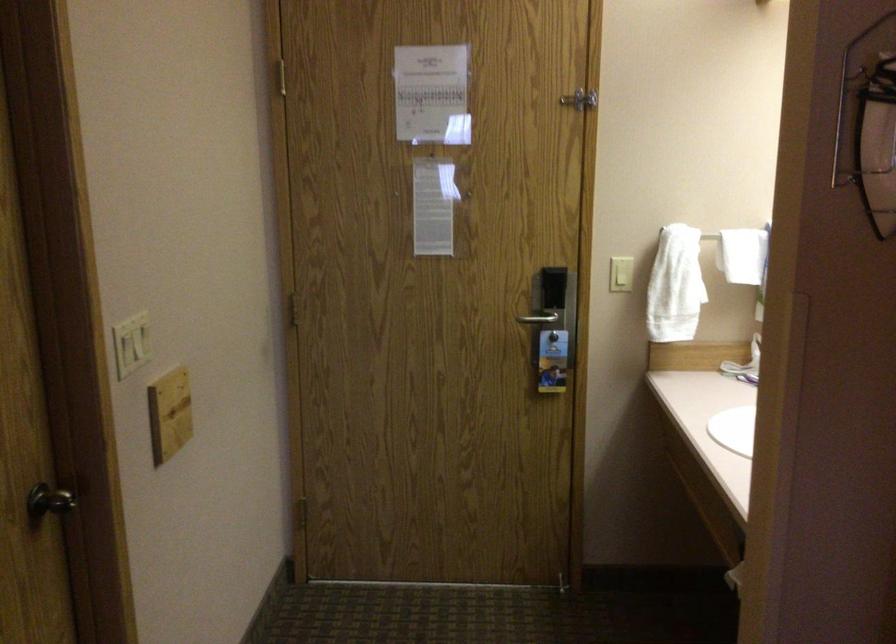
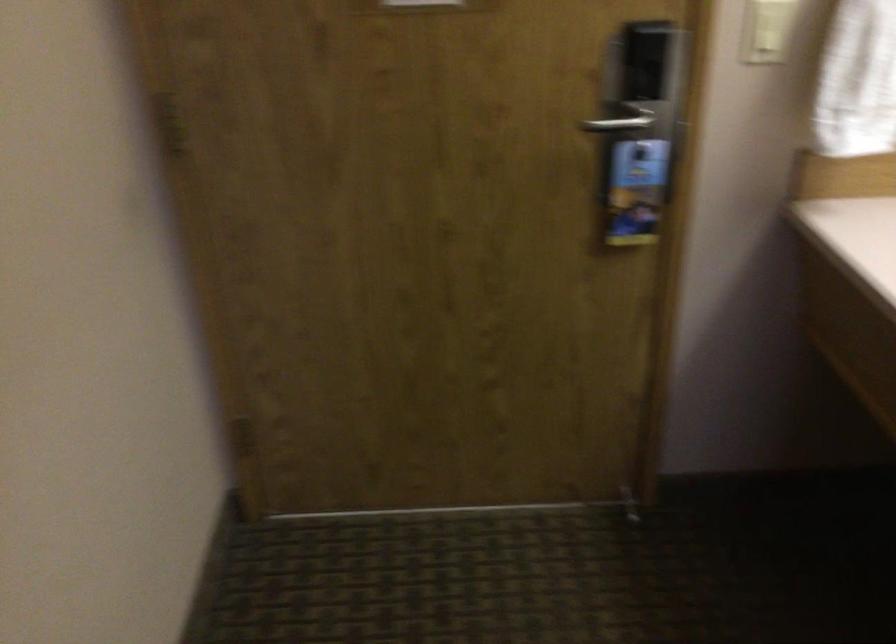
Question: In a continuous first-person perspective shot, in which direction is the camera moving?

Choices:
 (A) Left
 (B) Right
 (C) Forward
 (D) Backward

Answer: (C)